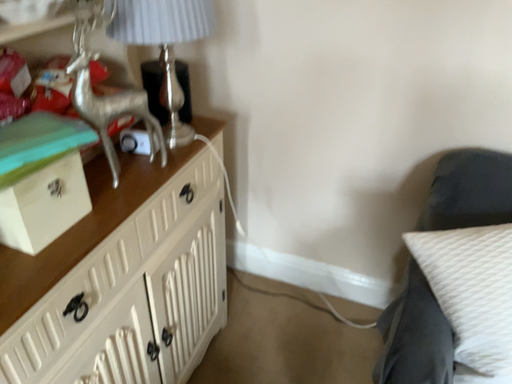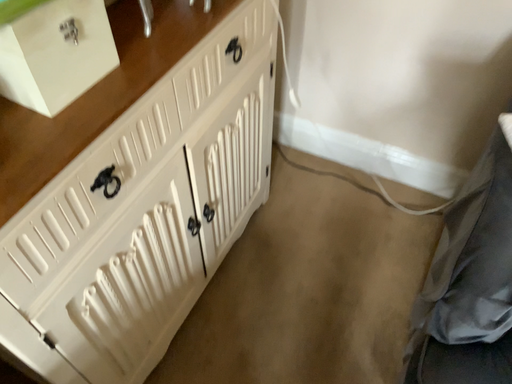
Question: How did the camera likely rotate when shooting the video?

Choices:
 (A) rotated upward
 (B) rotated downward

Answer: (B)